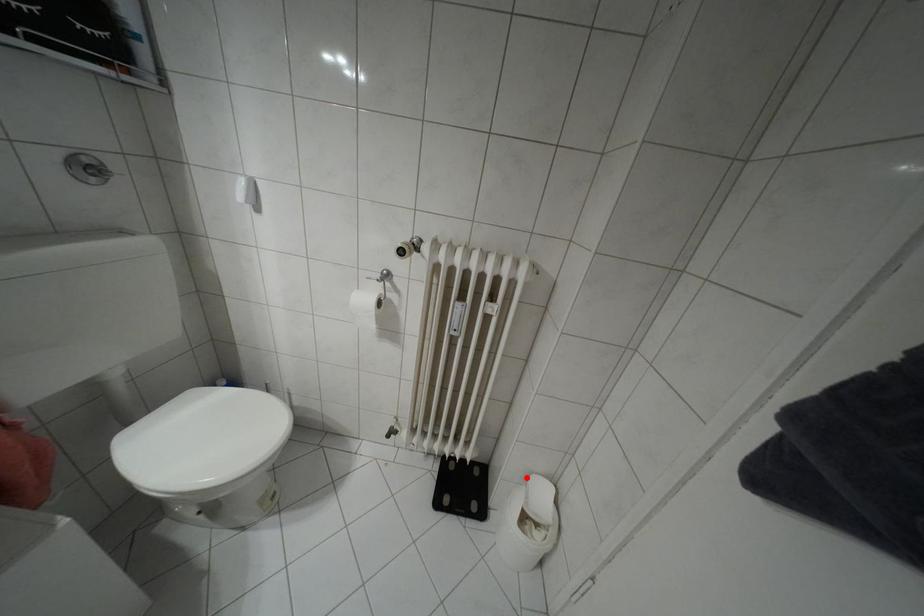
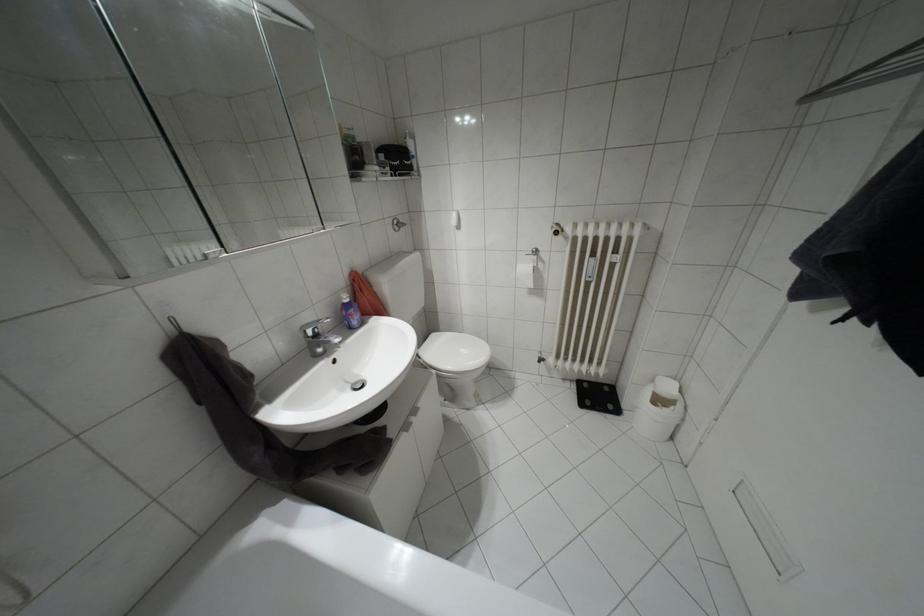
Question: I am providing you with two images of the same scene from different viewpoints. Image1 has a red point marked. In image2, the corresponding 3D location appears at what relative position? Reply with the corresponding letter.

Choices:
 (A) Closer
 (B) Farther

Answer: (A)